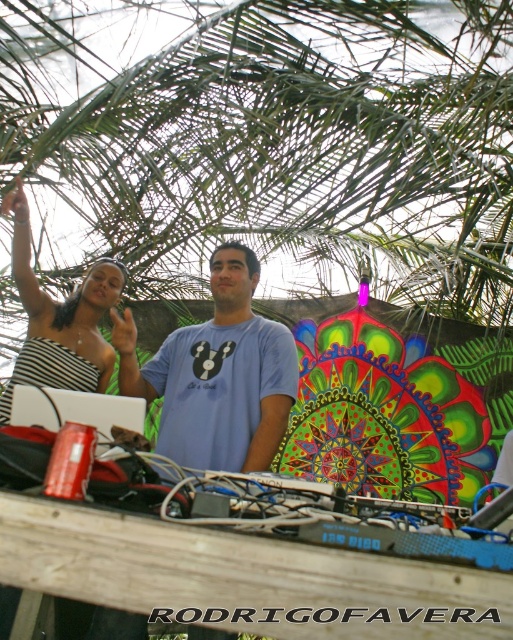
Can you confirm if blue cotton t-shirt at center is thinner than striped fabric dress at upper left?

In fact, blue cotton t-shirt at center might be wider than striped fabric dress at upper left.

Which is below, blue cotton t-shirt at center or striped fabric dress at upper left?

blue cotton t-shirt at center

Does point (151, 385) lie behind point (38, 330)?

Yes, point (151, 385) is behind point (38, 330).

You are a GUI agent. You are given a task and a screenshot of the screen. Output one action in this format:
    pyautogui.click(x=<x>, y=<y>)
    Task: Click on the blue cotton t-shirt at center
    Image resolution: width=513 pixels, height=640 pixels.
    Given the screenshot: What is the action you would take?
    pyautogui.click(x=216, y=374)